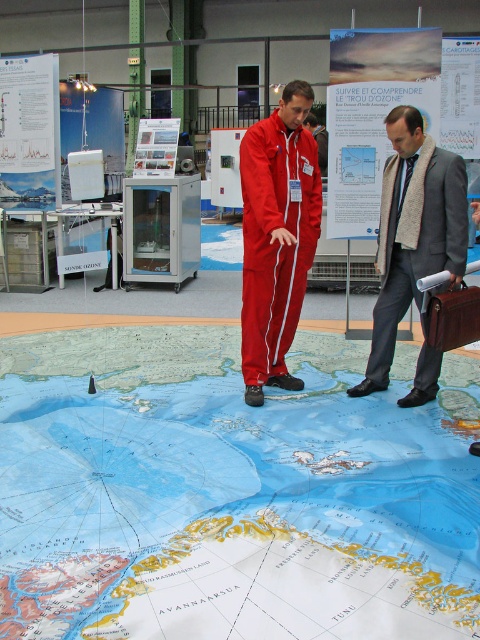
Question: Observing the image, what is the correct spatial positioning of blue paper map at center in reference to matte red jumpsuit at center?

Choices:
 (A) above
 (B) below

Answer: (B)

Question: Which of these objects is positioned closest to the blue paper map at center?

Choices:
 (A) brown leather briefcase at lower right
 (B) gray wool scarf at right

Answer: (A)

Question: Does gray wool scarf at right lie in front of brown leather briefcase at lower right?

Choices:
 (A) yes
 (B) no

Answer: (B)

Question: Can you confirm if matte red jumpsuit at center is positioned below brown leather briefcase at lower right?

Choices:
 (A) no
 (B) yes

Answer: (A)

Question: Based on their relative distances, which object is nearer to the matte red jumpsuit at center?

Choices:
 (A) gray wool scarf at right
 (B) brown leather briefcase at lower right
 (C) blue paper map at center

Answer: (A)

Question: Among these objects, which one is nearest to the camera?

Choices:
 (A) gray wool scarf at right
 (B) blue paper map at center

Answer: (B)